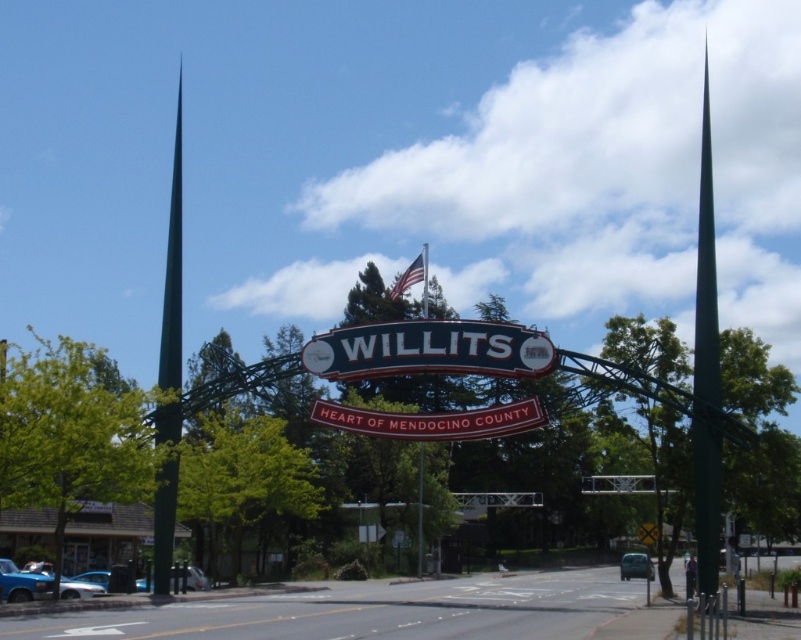
You are driving towards the red matte sign at center and the green metallic spire at right. Which object will you reach first?

You will reach the green metallic spire at right first because it is closer to the viewer than the red matte sign at center.

You are a delivery driver approaching Willits and need to park your truck. The parking space is only 10 feet wide. Can you fit between the metallic blue sign at center and the red matte sign at center?

The distance between the metallic blue sign at center and the red matte sign at center is 10.67 feet, so yes, the truck can fit since the space is wider than the required 10 feet.

Looking at this image, you are a painter who wants to paint the metallic blue sign at center and the green metallic spire at left. If you have a canvas that can only accommodate the wider object, which object should you choose to paint?

The green metallic spire at left is wider than the metallic blue sign at center, so you should choose to paint the green metallic spire at left.